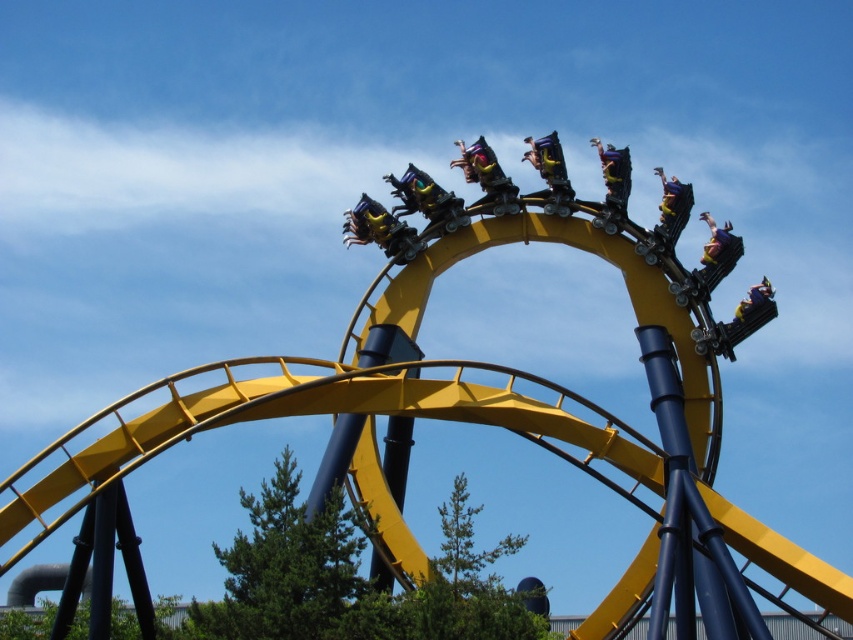
You are a safety inspector checking the roller coaster cars. You notice two cars, the metallic yellow roller coaster car at upper right and the matte yellow roller coaster car at upper right. According to the safety protocol, the car closer to the front of the train must have its safety bars inspected first. Which car should you inspect first?

The metallic yellow roller coaster car at upper right is to the left of the matte yellow roller coaster car at upper right. Since the roller coaster is moving forward, the car on the left would be closer to the front of the train. Therefore, you should inspect the metallic yellow roller coaster car at upper right first.

You are a safety inspector checking the roller coaster. You notice the matte yellow helmet at upper center and the yellow matte roller coaster car at upper right in your line of sight. Which object is closer to you?

The matte yellow helmet at upper center is closer to you because it is in front of the yellow matte roller coaster car at upper right.

You are a safety inspector checking the roller coaster. You notice the matte yellow helmet at upper center and the matte yellow roller coaster car at upper right in the image. Which object is taller?

The matte yellow helmet at upper center is taller than the matte yellow roller coaster car at upper right according to the description.